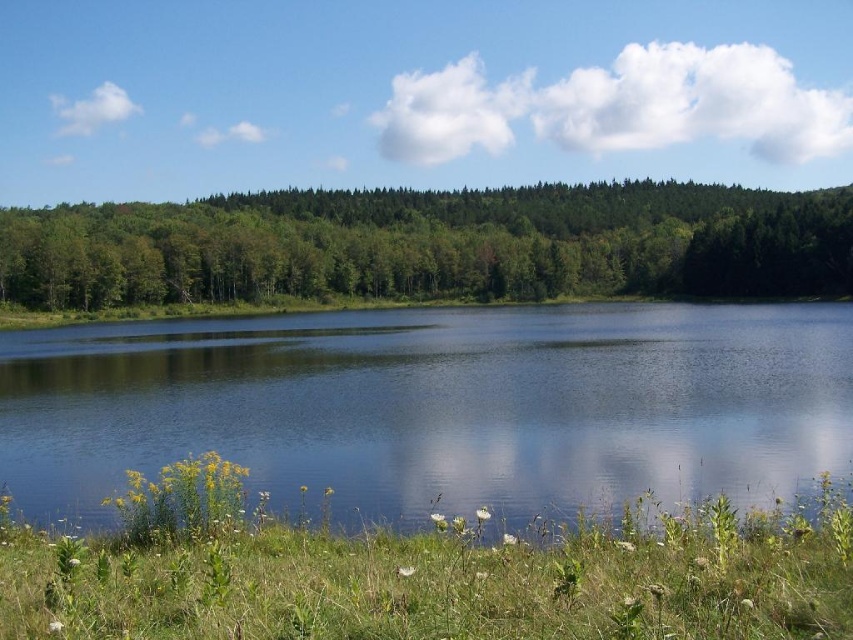
Question: Where is transparent water at center located in relation to green leafy forest at upper center in the image?

Choices:
 (A) left
 (B) right

Answer: (A)

Question: Which of the following is the closest to the observer?

Choices:
 (A) transparent water at center
 (B) green leafy forest at upper center

Answer: (A)

Question: Which point is farther to the camera?

Choices:
 (A) (112, 468)
 (B) (335, 218)

Answer: (B)

Question: Is transparent water at center bigger than green leafy forest at upper center?

Choices:
 (A) no
 (B) yes

Answer: (A)

Question: Can you confirm if transparent water at center is positioned to the left of green leafy forest at upper center?

Choices:
 (A) no
 (B) yes

Answer: (B)

Question: Among these objects, which one is nearest to the camera?

Choices:
 (A) transparent water at center
 (B) green leafy forest at upper center

Answer: (A)